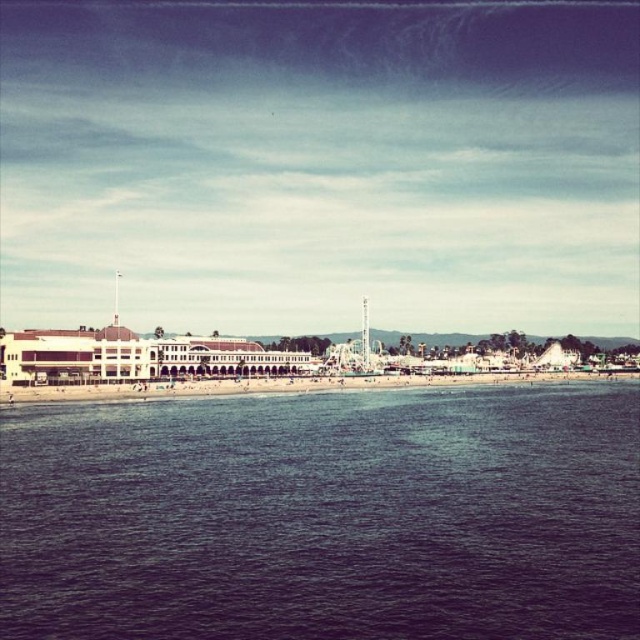
Between beach sand at lower center and metallic amusement park ride at center, which one has more height?

With more height is metallic amusement park ride at center.

You are a GUI agent. You are given a task and a screenshot of the screen. Output one action in this format:
    pyautogui.click(x=<x>, y=<y>)
    Task: Click on the beach sand at lower center
    This screenshot has width=640, height=640.
    Given the screenshot: What is the action you would take?
    pyautogui.click(x=289, y=385)

Between blue water at lower center and beach sand at lower center, which one has less height?

With less height is beach sand at lower center.

Identify the location of blue water at lower center. The width and height of the screenshot is (640, 640). (324, 516).

Which is below, blue water at lower center or metallic amusement park ride at center?

Positioned lower is blue water at lower center.

I want to click on blue water at lower center, so click(x=324, y=516).